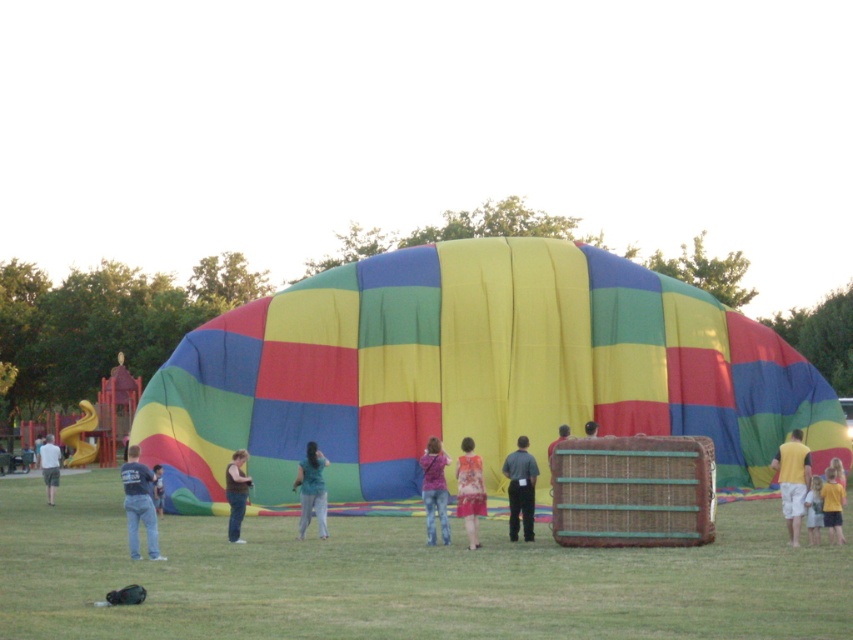
You are standing at the center of the hot air balloon festival scene. You need to find the denim pants at lower left. According to the coordinates provided, in which direction should you look to locate them?

The denim pants at lower left is located at point coordinates lower left, so you should look towards the lower left direction to find them.

You are a photographer standing at the edge of the hot air balloon festival. You notice the denim pants at lower left and the matte brown wicker basket at center. Which object is taller?

The denim pants at lower left is much taller than the matte brown wicker basket at center.